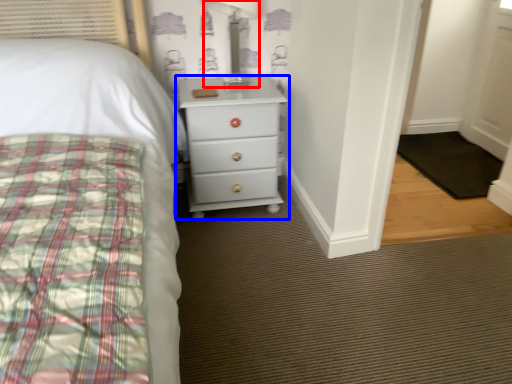
Question: Which point is further to the camera, table lamp (highlighted by a red box) or chest of drawers (highlighted by a blue box)?

Choices:
 (A) table lamp
 (B) chest of drawers

Answer: (B)